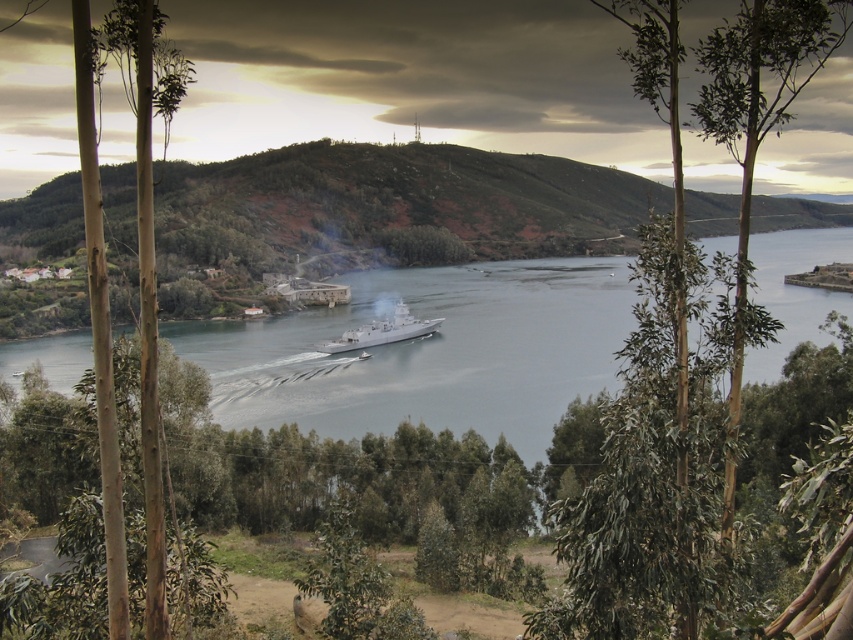
Does green leafy tree at center appear on the right side of silver metallic ship at center?

Yes, green leafy tree at center is to the right of silver metallic ship at center.

Can you confirm if green leafy tree at center is wider than silver metallic ship at center?

No, green leafy tree at center is not wider than silver metallic ship at center.

Find the location of a particular element. The height and width of the screenshot is (640, 853). green leafy tree at center is located at coordinates (662, 461).

This screenshot has height=640, width=853. I want to click on green leafy tree at center, so click(662, 461).

Is point (784, 113) farther from viewer compared to point (152, 598)?

No, (784, 113) is closer to viewer.

Between green leafy tree at center and brown smooth tree trunk at left, which one has more height?

With more height is green leafy tree at center.

Is point (747, 8) more distant than point (79, 45)?

Yes, point (747, 8) is farther from viewer.

Locate an element on the screen. This screenshot has width=853, height=640. green leafy tree at center is located at coordinates (662, 461).

Can you confirm if brown smooth tree trunk at left is bigger than silver metallic ship at center?

No, brown smooth tree trunk at left is not bigger than silver metallic ship at center.

The image size is (853, 640). Describe the element at coordinates (146, 296) in the screenshot. I see `brown smooth tree trunk at left` at that location.

The image size is (853, 640). I want to click on brown smooth tree trunk at left, so click(x=146, y=296).

The width and height of the screenshot is (853, 640). In order to click on brown smooth tree trunk at left in this screenshot , I will do `click(146, 296)`.